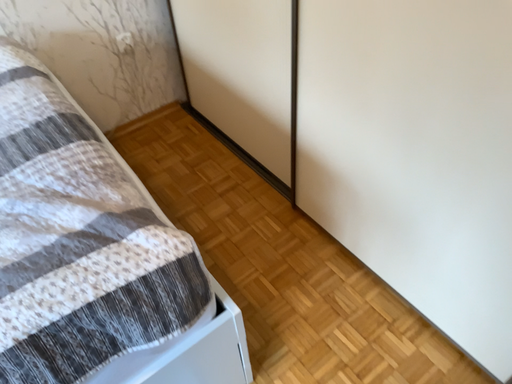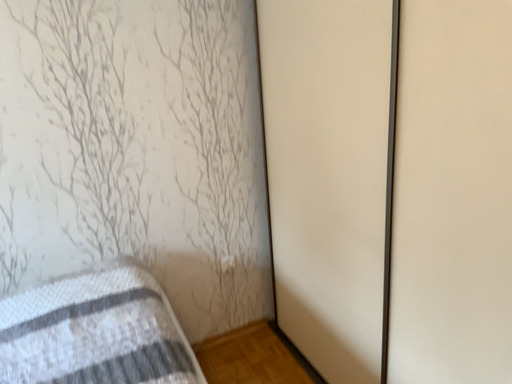
Question: Which way did the camera rotate in the video?

Choices:
 (A) rotated downward
 (B) rotated upward

Answer: (B)